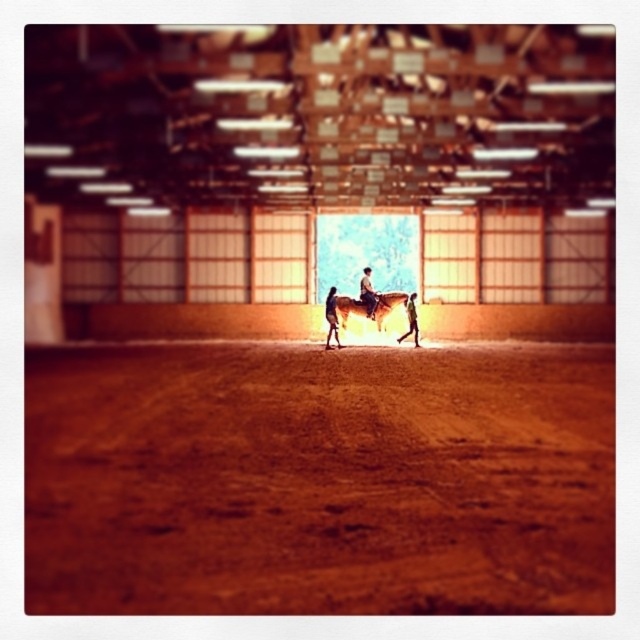
Who is positioned more to the left, smooth brown horse at center or light brown leather jacket at center?

From the viewer's perspective, smooth brown horse at center appears more on the left side.

Based on the photo, is smooth brown horse at center closer to camera compared to light brown leather jacket at center?

Yes, smooth brown horse at center is in front of light brown leather jacket at center.

Who is more forward, [369,301] or [419,344]?

Positioned in front is point [369,301].

At what (x,y) coordinates should I click in order to perform the action: click on smooth brown horse at center. Please return your answer as a coordinate pair (x, y). The height and width of the screenshot is (640, 640). Looking at the image, I should click on (368, 292).

Who is taller, brown textured dirt track at center or smooth brown horse at center?

smooth brown horse at center is taller.

Is brown textured dirt track at center above smooth brown horse at center?

Actually, brown textured dirt track at center is below smooth brown horse at center.

Identify the location of brown textured dirt track at center. The image size is (640, 640). (317, 480).

Identify the location of brown textured dirt track at center. The width and height of the screenshot is (640, 640). (317, 480).

Is point (557, 612) positioned after point (408, 298)?

No, it is not.

Which of these two, brown textured dirt track at center or light brown leather jacket at center, stands shorter?

brown textured dirt track at center is shorter.

Where is `brown textured dirt track at center`? The image size is (640, 640). brown textured dirt track at center is located at coordinates (317, 480).